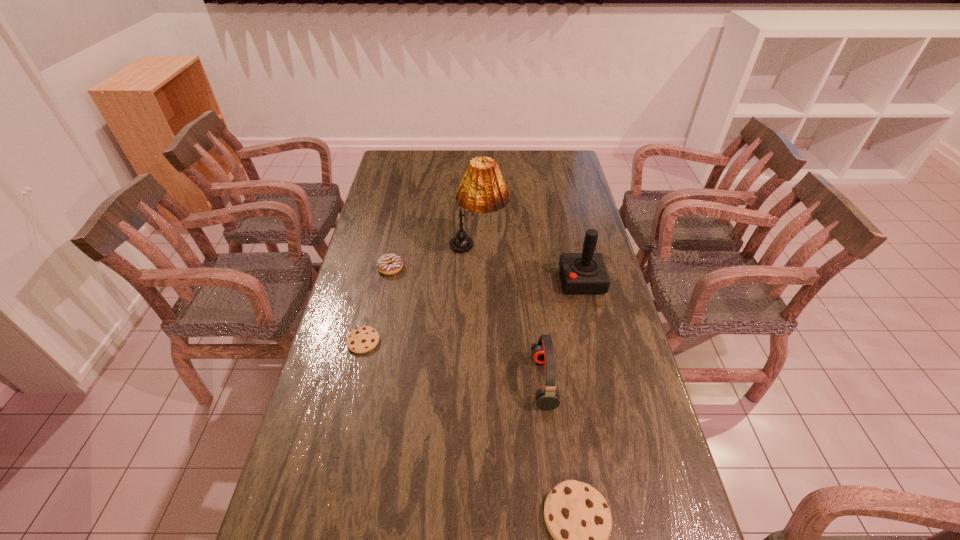
This screenshot has height=540, width=960. Find the location of `free space located on the base of the fifth shortest object`. free space located on the base of the fifth shortest object is located at coordinates (535, 280).

Locate an element on the screen. Image resolution: width=960 pixels, height=540 pixels. vacant region located on the front-facing side of the lampshade is located at coordinates (534, 249).

This screenshot has width=960, height=540. In order to click on blank space located 0.300m on the ear cups of the fourth shortest object in this screenshot , I will do `click(426, 381)`.

I want to click on vacant region located on the ear cups of the fourth shortest object, so click(515, 381).

The image size is (960, 540). What are the coordinates of `free space located on the ear cups of the fourth shortest object` in the screenshot? It's located at (458, 381).

The height and width of the screenshot is (540, 960). Find the location of `free space located 0.200m on the front of the doughnut`. free space located 0.200m on the front of the doughnut is located at coordinates point(379,320).

Locate an element on the screen. cookie present at the left edge is located at coordinates (360, 340).

The image size is (960, 540). I want to click on doughnut that is at the left edge, so click(x=395, y=262).

You are a GUI agent. You are given a task and a screenshot of the screen. Output one action in this format:
    pyautogui.click(x=<x>, y=<y>)
    Task: Click on the object at the right edge
    
    Given the screenshot: What is the action you would take?
    pyautogui.click(x=582, y=273)

Locate an element on the screen. free space at the far edge of the desktop is located at coordinates (516, 156).